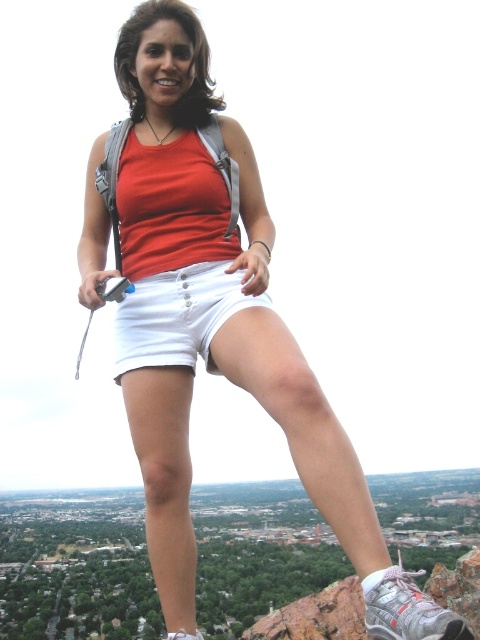
Question: Among these objects, which one is farthest from the camera?

Choices:
 (A) white cotton shorts at center
 (B) rocky cliff at upper center

Answer: (A)

Question: Does white cotton shorts at center appear over rocky cliff at upper center?

Choices:
 (A) yes
 (B) no

Answer: (A)

Question: Is rocky cliff at upper center smaller than matte red tank top at center?

Choices:
 (A) no
 (B) yes

Answer: (A)

Question: In this image, where is white cotton shorts at center located relative to matte red tank top at center?

Choices:
 (A) below
 (B) above

Answer: (A)

Question: Among these objects, which one is nearest to the camera?

Choices:
 (A) white cotton shorts at center
 (B) rocky cliff at upper center

Answer: (B)

Question: Among these points, which one is farthest from the camera?

Choices:
 (A) (113, 208)
 (B) (153, 310)

Answer: (B)